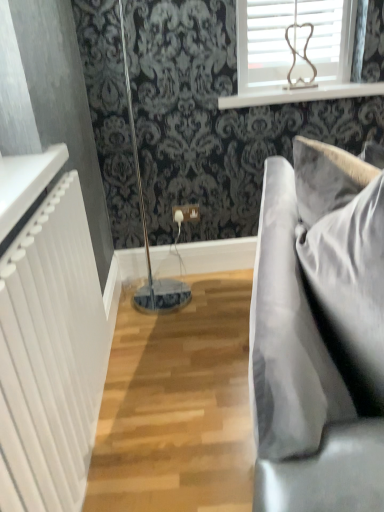
At what (x,y) coordinates should I click in order to perform the action: click on empty space that is ontop of white wood window sill at upper center (from a real-world perspective). Please return your answer as a coordinate pair (x, y). This screenshot has width=384, height=512. Looking at the image, I should click on (294, 91).